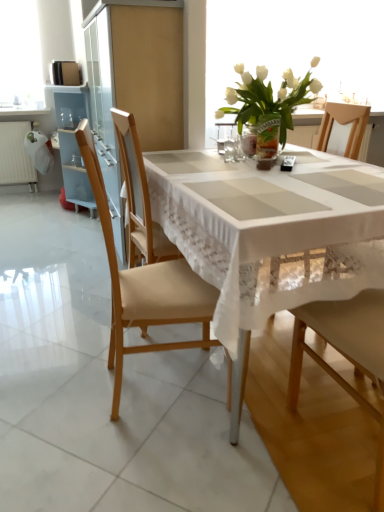
Identify the location of vacant space underneath light brown wood chair at left, acting as the 2th chair starting from the right (from a real-world perspective). (144, 382).